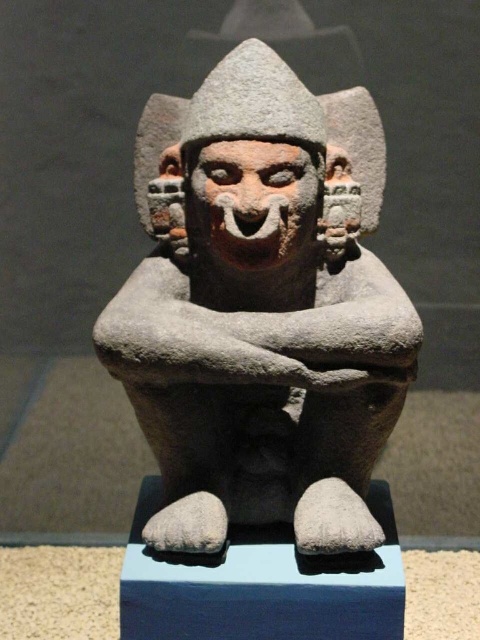
You are an archaeologist examining the ancient stone sculpture. You notice two points on the sculpture. The first point is at coordinates point (x=286, y=74) and the second is at point (x=322, y=157). Which point is closer to your viewpoint?

Point (x=286, y=74) is closer to the camera than point (x=322, y=157).

From the picture: You are a photographer standing in front of the gray stone statue at center. You want to take a photo of it from a distance that ensures the statue fills the frame without being too close. The recommended minimum distance for such shots is 1.5 meters to avoid distortion. Is your current position suitable?

The gray stone statue at center is 1.69 meters away from the camera, which is beyond the recommended minimum distance of 1.5 meters. Therefore, your current position is suitable for taking a photo without distortion.